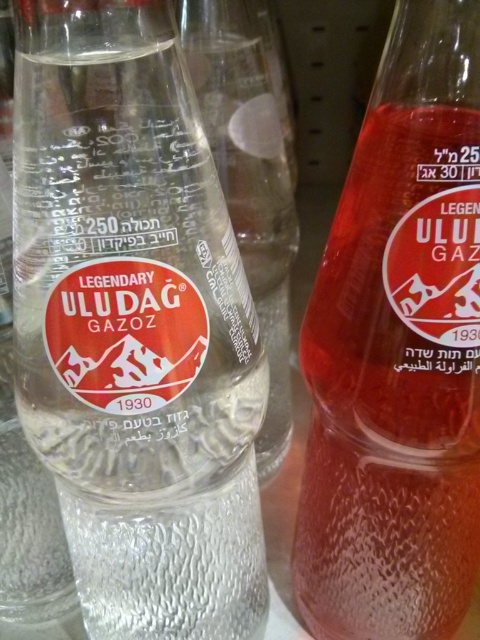
From the picture: Who is more forward, (x=132, y=20) or (x=414, y=45)?

Point (x=132, y=20) is more forward.

In the scene shown: Who is higher up, clear glass bottle at center or translucent glass bottle at center?

translucent glass bottle at center

Find the location of a particular element. The height and width of the screenshot is (640, 480). clear glass bottle at center is located at coordinates (134, 324).

Locate an element on the screen. clear glass bottle at center is located at coordinates (134, 324).